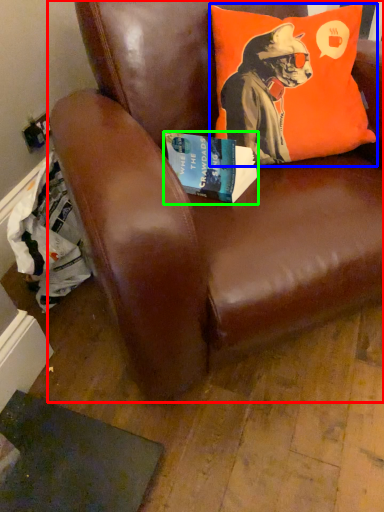
Question: Estimate the real-world distances between objects in this image. Which object is farther from chair (highlighted by a red box), pillow (highlighted by a blue box) or book (highlighted by a green box)?

Choices:
 (A) pillow
 (B) book

Answer: (B)